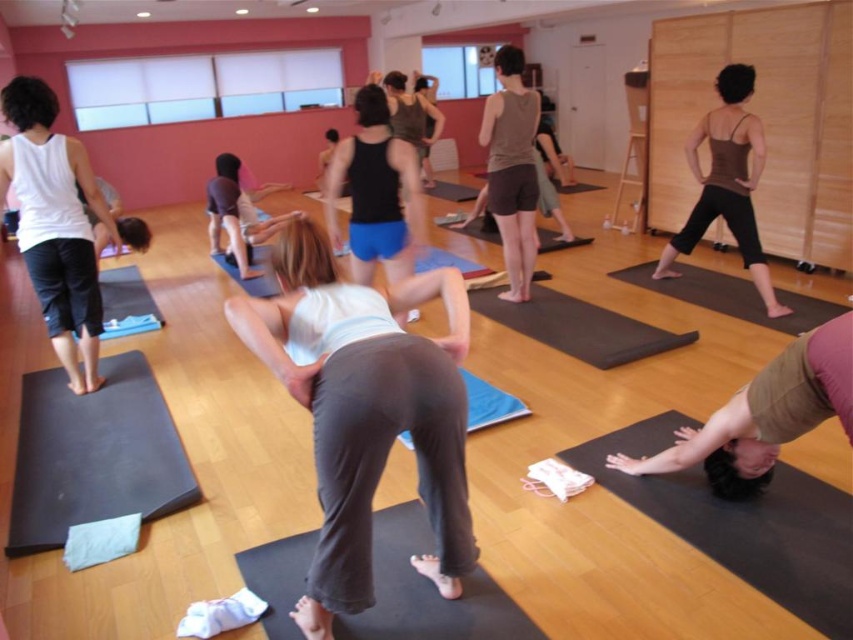
You are a participant in the yoga class and want to place your personal black rubber yoga mat at lower left on the floor. However, there is already a black rubber yoga mat at lower right in the way. Can you place your mat there without moving the existing mat?

The black rubber yoga mat at lower left is positioned over the black rubber yoga mat at lower right, so you cannot place your mat there without moving the existing mat.

You are a photographer positioned at the back of the studio. You want to take a photo that includes both the white cotton tank top at left and the matte brown tank top at center. Which tank top should you adjust your camera to focus on first to ensure both are in frame?

The white cotton tank top at left is to the left of the matte brown tank top at center, so you should focus on the white cotton tank top at left first to ensure both are in frame.

You are a photographer standing at the back of the yoga studio. You want to take a photo of the black matte tank top at center and the black rubber mat at center. Which object will appear taller in the photo?

The black matte tank top at center will appear taller in the photo because it has a greater height compared to the black rubber mat at center.